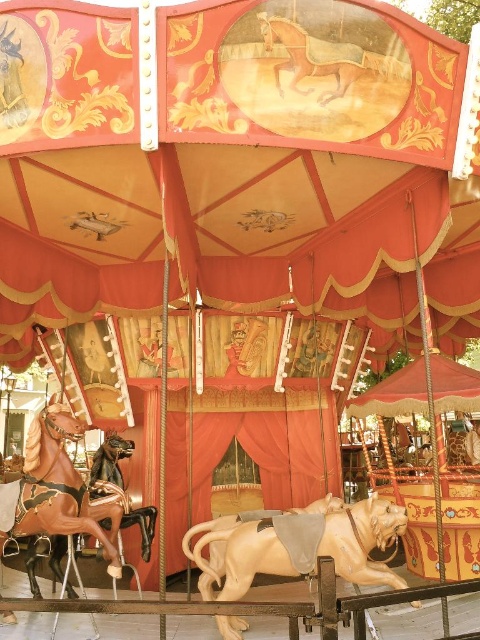
Question: Which point is farther to the camera?

Choices:
 (A) light beige wood horse at center
 (B) shiny brown horse at left

Answer: (A)

Question: Which point is farther from the camera taking this photo?

Choices:
 (A) pos(261,563)
 (B) pos(211,554)

Answer: (B)

Question: Which of the following is the closest to the observer?

Choices:
 (A) (48, 448)
 (B) (238, 570)
 (C) (183, 545)
 (D) (300, 35)

Answer: (D)

Question: In this image, where is light brown polished wood horse at center located relative to shiny brown horse at left?

Choices:
 (A) above
 (B) below

Answer: (B)

Question: Is golden polished wood horse at upper center below light beige wood horse at center?

Choices:
 (A) yes
 (B) no

Answer: (B)

Question: Where is light brown polished wood horse at center located in relation to golden polished wood horse at upper center in the image?

Choices:
 (A) right
 (B) left

Answer: (B)